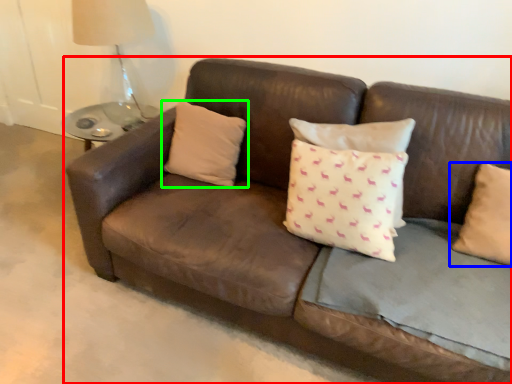
Question: Which object is the closest to the studio couch (highlighted by a red box)? Choose among these: pillow (highlighted by a blue box) or pillow (highlighted by a green box).

Choices:
 (A) pillow
 (B) pillow

Answer: (B)